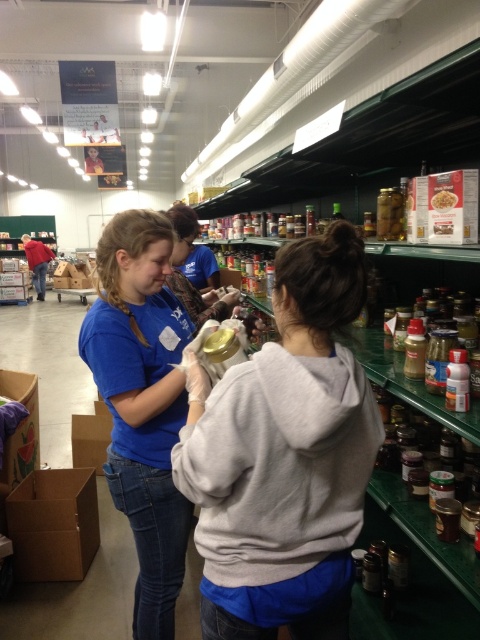
Consider the image. Which is below, brown cardboard box at lower left or matte cardboard box at center?

brown cardboard box at lower left is lower down.

Does brown cardboard box at lower left have a greater height compared to matte cardboard box at center?

Yes.

The image size is (480, 640). I want to click on brown cardboard box at lower left, so click(x=54, y=524).

Can you confirm if matte yellow jar at center is smaller than green glass jar at upper right?

Actually, matte yellow jar at center might be larger than green glass jar at upper right.

Which is behind, point (352, 396) or point (404, 212)?

Positioned behind is point (404, 212).

Is point (361, 460) more distant than point (391, 196)?

No.

This screenshot has height=640, width=480. Identify the location of matte yellow jar at center. (285, 456).

Does point (256, 413) lie behind point (436, 209)?

No, (256, 413) is in front of (436, 209).

Who is more forward, (195, 424) or (447, 209)?

Point (195, 424) is more forward.

Is point (251, 547) less distant than point (453, 202)?

Yes, point (251, 547) is in front of point (453, 202).

Where is `matte yellow jar at center`? matte yellow jar at center is located at coordinates (285, 456).